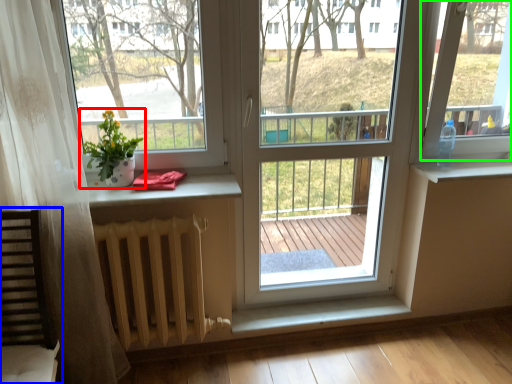
Question: Which object is the farthest from houseplant (highlighted by a red box)? Choose among these: rocking chair (highlighted by a blue box) or window screen (highlighted by a green box).

Choices:
 (A) rocking chair
 (B) window screen

Answer: (B)